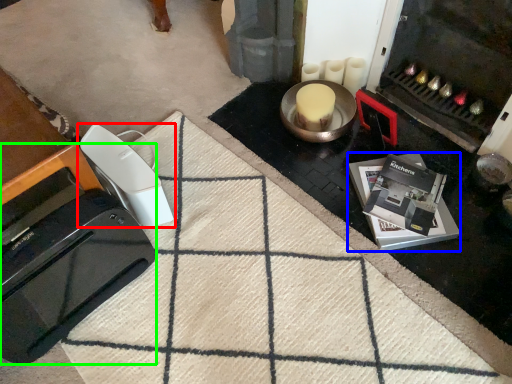
Question: Considering the real-world distances, which object is farthest from home appliance (highlighted by a red box)? appliance (highlighted by a blue box) or home appliance (highlighted by a green box)?

Choices:
 (A) appliance
 (B) home appliance

Answer: (A)